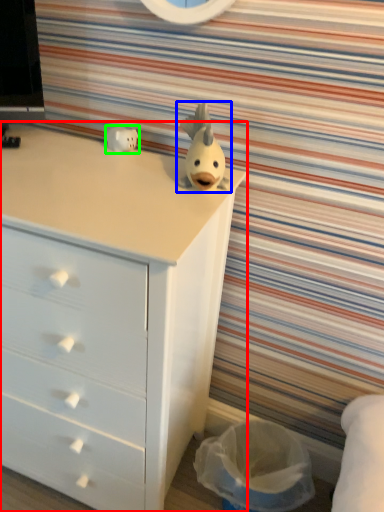
Question: Estimate the real-world distances between objects in this image. Which object is closer to chest of drawers (highlighted by a red box), toy (highlighted by a blue box) or toy (highlighted by a green box)?

Choices:
 (A) toy
 (B) toy

Answer: (A)